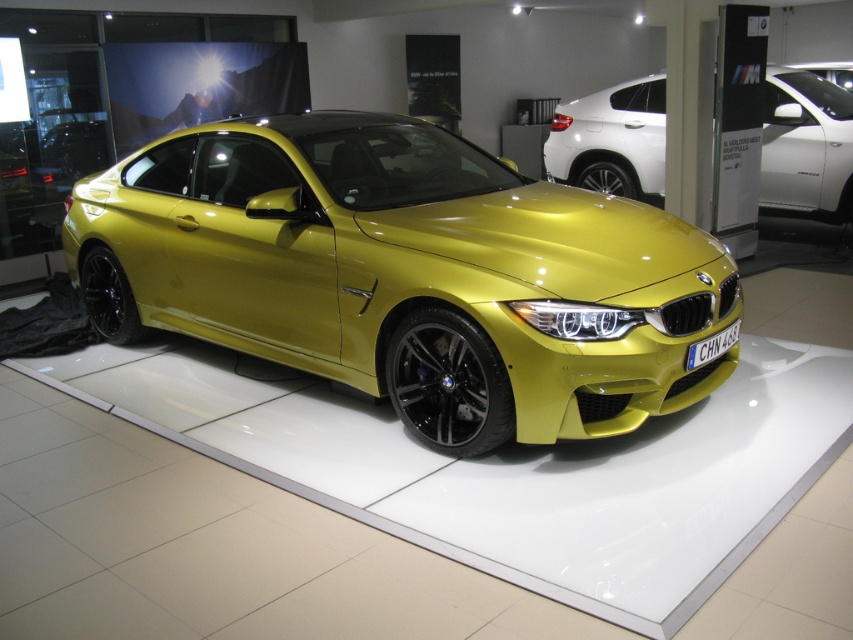
Question: Can you confirm if metallic yellow car at center is positioned to the left of metallic yellow car at upper right?

Choices:
 (A) yes
 (B) no

Answer: (A)

Question: Which object is closer to the camera taking this photo?

Choices:
 (A) metallic yellow car at upper right
 (B) metallic yellow car at center

Answer: (B)

Question: In this image, where is metallic yellow car at center located relative to metallic yellow car at upper right?

Choices:
 (A) right
 (B) left

Answer: (B)

Question: Among these points, which one is farthest from the camera?

Choices:
 (A) (831, 145)
 (B) (126, 250)

Answer: (A)

Question: Which point appears farthest from the camera in this image?

Choices:
 (A) (651, 168)
 (B) (344, 248)

Answer: (A)

Question: Does metallic yellow car at center appear over metallic yellow car at upper right?

Choices:
 (A) yes
 (B) no

Answer: (B)